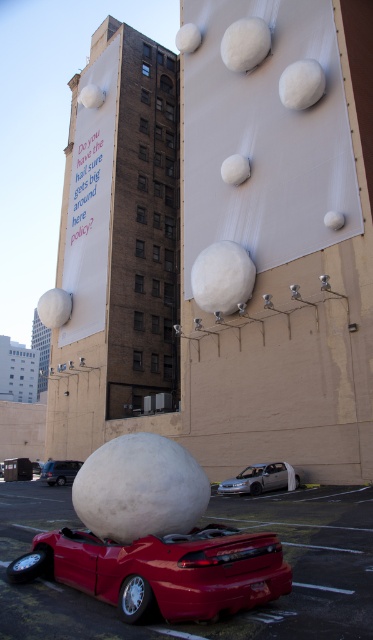
Who is more forward, (280, 538) or (52, 472)?

Point (280, 538) is in front.

Consider the image. Between metallic red car at lower center and metallic red car at lower left, which one is positioned higher?

metallic red car at lower center is higher up.

Locate an element on the screen. This screenshot has height=640, width=373. metallic red car at lower center is located at coordinates (201, 524).

Does metallic red car at lower center appear under silver metallic sedan at center?

Actually, metallic red car at lower center is above silver metallic sedan at center.

This screenshot has height=640, width=373. Describe the element at coordinates (201, 524) in the screenshot. I see `metallic red car at lower center` at that location.

Locate an element on the screen. metallic red car at lower center is located at coordinates (201, 524).

How distant is shiny red car at lower center from metallic red car at lower left?

shiny red car at lower center is 25.97 meters away from metallic red car at lower left.

Which of these two, shiny red car at lower center or metallic red car at lower left, stands shorter?

metallic red car at lower left is shorter.

Describe the element at coordinates (163, 570) in the screenshot. This screenshot has height=640, width=373. I see `shiny red car at lower center` at that location.

Image resolution: width=373 pixels, height=640 pixels. What are the coordinates of `shiny red car at lower center` in the screenshot? It's located at (163, 570).